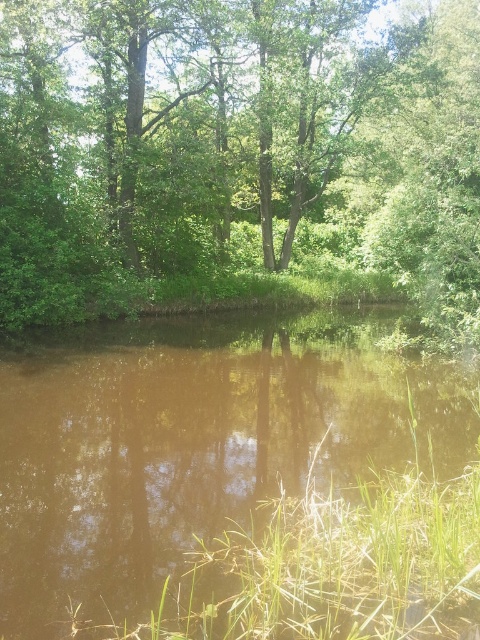
Question: In this image, where is green leafy tree at center located relative to brown murky water at center?

Choices:
 (A) left
 (B) right

Answer: (B)

Question: Is green leafy tree at center to the left of brown murky water at center from the viewer's perspective?

Choices:
 (A) no
 (B) yes

Answer: (A)

Question: Which point is closer to the camera?

Choices:
 (A) green leafy tree at center
 (B) brown murky water at center

Answer: (B)

Question: Which point is farther to the camera?

Choices:
 (A) (260, 60)
 (B) (172, 388)

Answer: (A)

Question: Can you confirm if green leafy tree at center is wider than brown murky water at center?

Choices:
 (A) no
 (B) yes

Answer: (B)